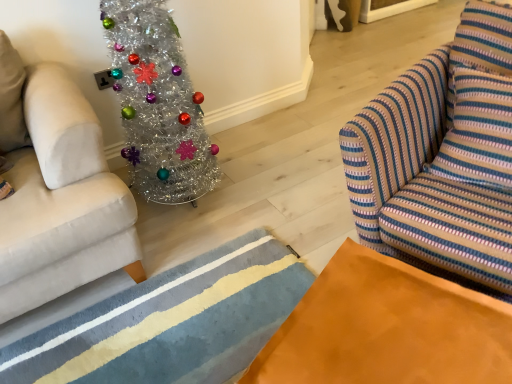
In order to click on textured wool rug at lower center in this screenshot , I will do `click(132, 304)`.

Image resolution: width=512 pixels, height=384 pixels. What do you see at coordinates (441, 156) in the screenshot?
I see `striped fabric swivel chair at right` at bounding box center [441, 156].

Identify the location of shiny silver christmas tree at left. (158, 104).

Identify the location of textured wool rug at lower center. (132, 304).

Between orange suede table at lower right and textured wool rug at lower center, which one is positioned in front?

orange suede table at lower right is closer to the camera.

Is orange suede table at lower right not near textured wool rug at lower center?

No, orange suede table at lower right is not far away from textured wool rug at lower center.

Can textured wool rug at lower center be found inside orange suede table at lower right?

Actually, textured wool rug at lower center is outside orange suede table at lower right.

What's the angular difference between orange suede table at lower right and textured wool rug at lower center's facing directions?

They differ by 158 degrees in their facing directions.

Considering the sizes of objects orange suede table at lower right and striped fabric swivel chair at right in the image provided, who is bigger, orange suede table at lower right or striped fabric swivel chair at right?

striped fabric swivel chair at right.

Is orange suede table at lower right wider or thinner than striped fabric swivel chair at right?

Clearly, orange suede table at lower right has less width compared to striped fabric swivel chair at right.

Which is more to the right, orange suede table at lower right or striped fabric swivel chair at right?

Positioned to the right is striped fabric swivel chair at right.

Is the surface of orange suede table at lower right in direct contact with striped fabric swivel chair at right?

No, orange suede table at lower right is not with striped fabric swivel chair at right.

Who is more distant, textured wool rug at lower center or shiny silver christmas tree at left?

Positioned behind is shiny silver christmas tree at left.

Is textured wool rug at lower center oriented towards shiny silver christmas tree at left?

No, textured wool rug at lower center is not oriented towards shiny silver christmas tree at left.

Is textured wool rug at lower center inside or outside of shiny silver christmas tree at left?

textured wool rug at lower center lies outside shiny silver christmas tree at left.

Looking at the image, does textured wool rug at lower center seem bigger or smaller compared to shiny silver christmas tree at left?

Clearly, textured wool rug at lower center is smaller in size than shiny silver christmas tree at left.

Measure the distance from orange suede table at lower right to shiny silver christmas tree at left.

orange suede table at lower right and shiny silver christmas tree at left are 1.09 meters apart.

From a real-world perspective, is orange suede table at lower right located higher than shiny silver christmas tree at left?

No, from a real-world perspective, orange suede table at lower right is not above shiny silver christmas tree at left.

Is orange suede table at lower right to the left of shiny silver christmas tree at left from the viewer's perspective?

No, orange suede table at lower right is not to the left of shiny silver christmas tree at left.

Consider the image. From the image's perspective, who appears lower, orange suede table at lower right or shiny silver christmas tree at left?

From the image's view, orange suede table at lower right is below.

Does shiny silver christmas tree at left have a smaller size compared to orange suede table at lower right?

No.

Between shiny silver christmas tree at left and orange suede table at lower right, which one appears on the left side from the viewer's perspective?

shiny silver christmas tree at left is more to the left.

Does shiny silver christmas tree at left have a lesser height compared to orange suede table at lower right?

In fact, shiny silver christmas tree at left may be taller than orange suede table at lower right.

The image size is (512, 384). In order to click on stripe on the right of shiny silver christmas tree at left in this screenshot , I will do `click(132, 304)`.

Relative to textured wool rug at lower center, is shiny silver christmas tree at left in front or behind?

Visually, shiny silver christmas tree at left is located behind textured wool rug at lower center.

Do you think shiny silver christmas tree at left is within textured wool rug at lower center, or outside of it?

shiny silver christmas tree at left is outside textured wool rug at lower center.

Is textured wool rug at lower center to the left or to the right of orange suede table at lower right in the image?

textured wool rug at lower center is to the left of orange suede table at lower right.

Looking at the image, does textured wool rug at lower center seem bigger or smaller compared to orange suede table at lower right?

Considering their sizes, textured wool rug at lower center takes up less space than orange suede table at lower right.

Does point (1, 364) come in front of point (466, 345)?

No.

I want to click on table below the textured wool rug at lower center (from the image's perspective), so click(x=387, y=328).

Identify the location of swivel chair above the orange suede table at lower right (from the image's perspective). The width and height of the screenshot is (512, 384). (441, 156).

Which object lies nearer to the anchor point textured wool rug at lower center, shiny silver christmas tree at left or striped fabric swivel chair at right?

The object closer to textured wool rug at lower center is shiny silver christmas tree at left.

Based on the photo, from the image, which object appears to be farther from shiny silver christmas tree at left, orange suede table at lower right or striped fabric swivel chair at right?

orange suede table at lower right is further to shiny silver christmas tree at left.

When comparing their distances from striped fabric swivel chair at right, does textured wool rug at lower center or orange suede table at lower right seem further?

textured wool rug at lower center is positioned further to the anchor striped fabric swivel chair at right.

Considering their positions, is orange suede table at lower right positioned closer to shiny silver christmas tree at left than textured wool rug at lower center?

Based on the image, textured wool rug at lower center appears to be nearer to shiny silver christmas tree at left.

Which object lies further to the anchor point shiny silver christmas tree at left, textured wool rug at lower center or orange suede table at lower right?

Among the two, orange suede table at lower right is located further to shiny silver christmas tree at left.

Looking at the image, which one is located further to textured wool rug at lower center, shiny silver christmas tree at left or orange suede table at lower right?

orange suede table at lower right is further to textured wool rug at lower center.

Based on their spatial positions, is shiny silver christmas tree at left or textured wool rug at lower center closer to striped fabric swivel chair at right?

Based on the image, textured wool rug at lower center appears to be nearer to striped fabric swivel chair at right.

Estimate the real-world distances between objects in this image. Which object is closer to textured wool rug at lower center, orange suede table at lower right or striped fabric swivel chair at right?

striped fabric swivel chair at right lies closer to textured wool rug at lower center than the other object.

I want to click on stripe situated between shiny silver christmas tree at left and striped fabric swivel chair at right from left to right, so click(x=132, y=304).

In order to click on table located between textured wool rug at lower center and striped fabric swivel chair at right in the left-right direction in this screenshot , I will do `click(387, 328)`.

Image resolution: width=512 pixels, height=384 pixels. What are the coordinates of `table located between shiny silver christmas tree at left and striped fabric swivel chair at right in the left-right direction` in the screenshot? It's located at (387, 328).

You are a GUI agent. You are given a task and a screenshot of the screen. Output one action in this format:
    pyautogui.click(x=<x>, y=<y>)
    Task: Click on the stripe between shiny silver christmas tree at left and orange suede table at lower right in the vertical direction
    This screenshot has width=512, height=384.
    Given the screenshot: What is the action you would take?
    pyautogui.click(x=132, y=304)